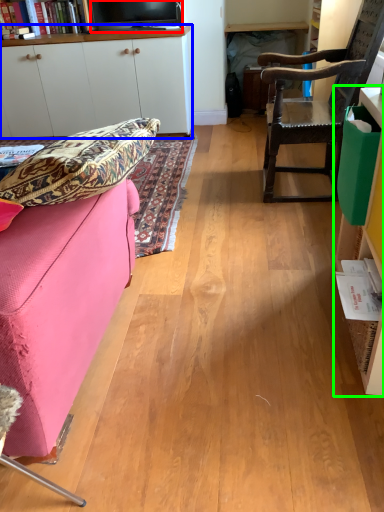
Question: Which object is the farthest from television (highlighted by a red box)? Choose among these: cabinetry (highlighted by a blue box) or cabinetry (highlighted by a green box).

Choices:
 (A) cabinetry
 (B) cabinetry

Answer: (B)